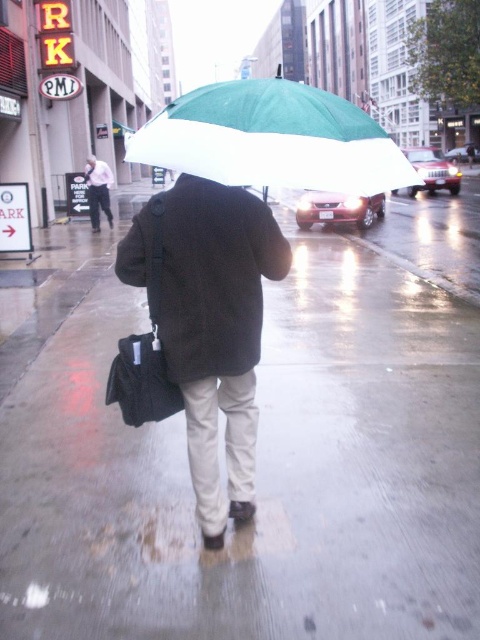
Question: Which point is closer to the camera taking this photo?

Choices:
 (A) (149, 236)
 (B) (261, 88)

Answer: (B)

Question: Does wet asphalt sidewalk at center appear over light pink shirt at upper left?

Choices:
 (A) no
 (B) yes

Answer: (A)

Question: Is wet asphalt sidewalk at center bigger than dark brown wool coat at center?

Choices:
 (A) yes
 (B) no

Answer: (A)

Question: Among these points, which one is nearest to the camera?

Choices:
 (A) (72, 349)
 (B) (372, 134)
 (C) (162, 196)
 (D) (105, 163)

Answer: (B)

Question: Among these objects, which one is nearest to the camera?

Choices:
 (A) wet asphalt sidewalk at center
 (B) light pink shirt at upper left
 (C) green/white fabric umbrella at upper center
 (D) dark brown wool coat at center

Answer: (C)

Question: Does green/white fabric umbrella at upper center appear over light pink shirt at upper left?

Choices:
 (A) no
 (B) yes

Answer: (B)